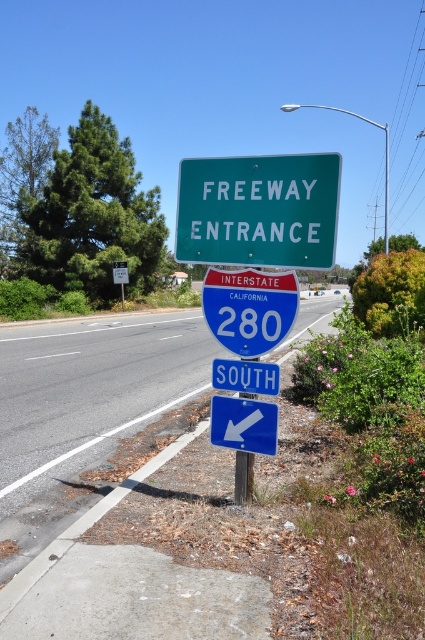
Question: Does blue glossy interstate sign at center lie behind blue plastic sign at lower center?

Choices:
 (A) yes
 (B) no

Answer: (A)

Question: Which point is farther from the camera taking this photo?

Choices:
 (A) (275, 406)
 (B) (240, 368)

Answer: (B)

Question: Does blue glossy arrow at lower center appear on the right side of metallic pole at center?

Choices:
 (A) no
 (B) yes

Answer: (A)

Question: Is blue plastic sign at lower center above metallic pole at center?

Choices:
 (A) no
 (B) yes

Answer: (B)

Question: Which object is farther from the camera taking this photo?

Choices:
 (A) blue glossy arrow at lower center
 (B) blue plastic sign at lower center
 (C) green matte freeway entrance sign at upper center
 (D) metallic pole at center

Answer: (D)

Question: Which of the following is the farthest from the observer?

Choices:
 (A) (244, 332)
 (B) (257, 364)
 (C) (269, 438)
 (D) (232, 170)

Answer: (B)